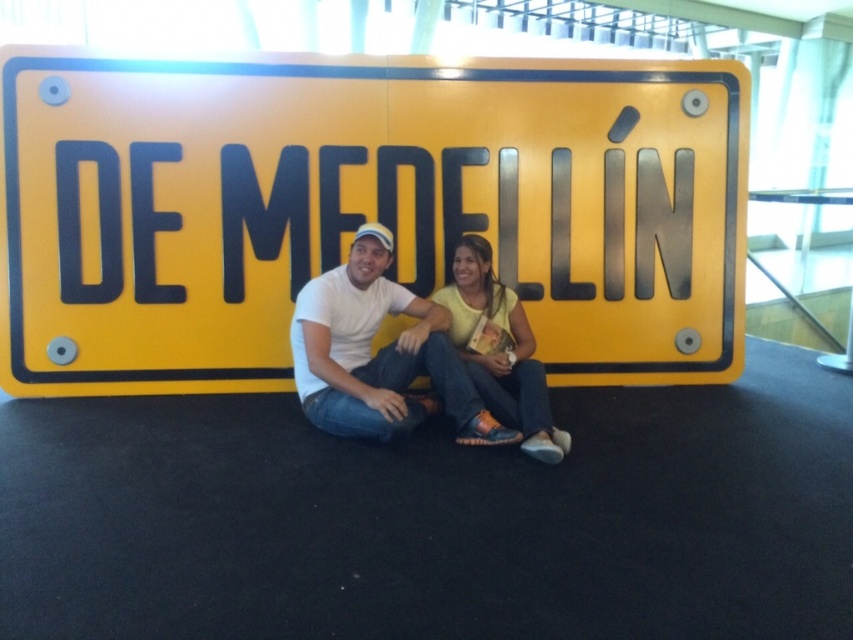
Can you confirm if yellow matte sign at center is positioned to the left of yellow matte shirt at center?

Yes, yellow matte sign at center is to the left of yellow matte shirt at center.

Can you confirm if yellow matte sign at center is positioned above yellow matte shirt at center?

Indeed, yellow matte sign at center is positioned over yellow matte shirt at center.

Consider the image. Measure the distance between point [228,387] and camera.

Point [228,387] and camera are 3.91 meters apart.

The height and width of the screenshot is (640, 853). Identify the location of yellow matte sign at center. (361, 209).

Who is lower down, white matte t-shirt at center or yellow matte shirt at center?

white matte t-shirt at center is below.

Is point (461, 422) closer to viewer compared to point (485, 394)?

Yes, it is in front of point (485, 394).

I want to click on white matte t-shirt at center, so click(378, 353).

Does yellow matte sign at center have a lesser width compared to white matte t-shirt at center?

No.

Image resolution: width=853 pixels, height=640 pixels. Identify the location of yellow matte sign at center. (361, 209).

Identify the location of yellow matte sign at center. The height and width of the screenshot is (640, 853). (361, 209).